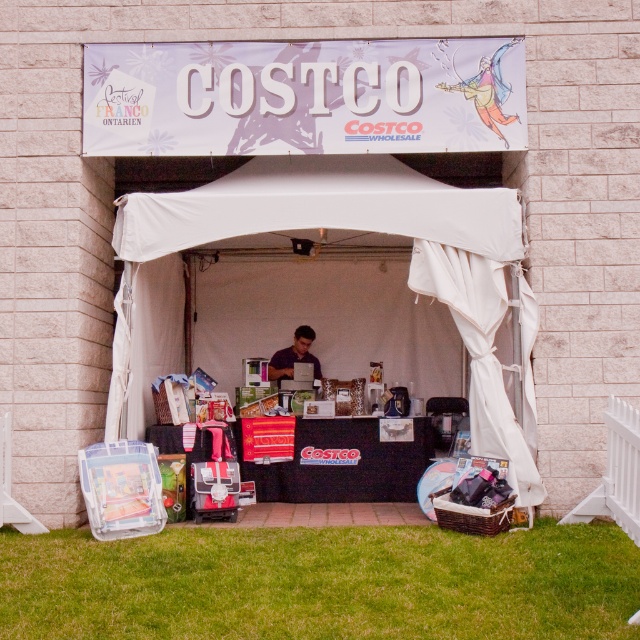
Does green grass at lower center have a lesser width compared to white fabric tent at center?

No, green grass at lower center is not thinner than white fabric tent at center.

In the scene shown: Who is positioned more to the right, green grass at lower center or white fabric tent at center?

white fabric tent at center is more to the right.

Which is in front, point (243, 564) or point (474, 392)?

Point (243, 564)

Locate an element on the screen. This screenshot has width=640, height=640. green grass at lower center is located at coordinates (x=321, y=582).

Looking at this image, is white fabric tent at center to the left of matte black laptop at center from the viewer's perspective?

Incorrect, white fabric tent at center is not on the left side of matte black laptop at center.

Does white fabric tent at center have a lesser width compared to matte black laptop at center?

In fact, white fabric tent at center might be wider than matte black laptop at center.

This screenshot has height=640, width=640. In order to click on white fabric tent at center in this screenshot , I will do `click(384, 232)`.

At what (x,y) coordinates should I click in order to perform the action: click on white fabric tent at center. Please return your answer as a coordinate pair (x, y). Looking at the image, I should click on (384, 232).

Between green grass at lower center and matte black laptop at center, which one appears on the right side from the viewer's perspective?

Positioned to the right is green grass at lower center.

Between point (164, 602) and point (310, 333), which one is positioned in front?

Point (164, 602) is in front.

Identify the location of green grass at lower center. The height and width of the screenshot is (640, 640). (321, 582).